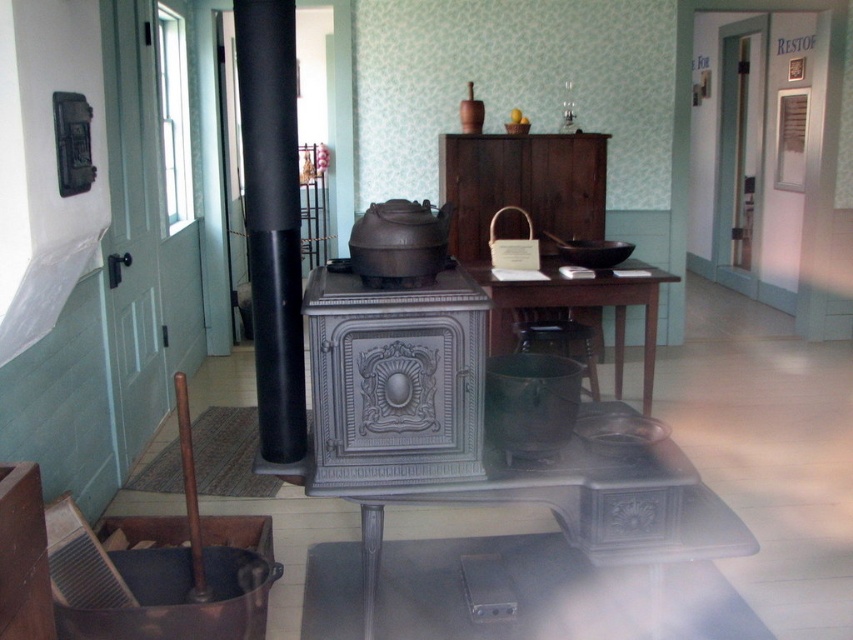
Question: Is metallic gray stove at center wider than wooden stool at center?

Choices:
 (A) yes
 (B) no

Answer: (A)

Question: Is dark wood table at center below wooden stool at center?

Choices:
 (A) yes
 (B) no

Answer: (B)

Question: Does dark wood table at center appear on the right side of wooden stool at center?

Choices:
 (A) no
 (B) yes

Answer: (B)

Question: Among these points, which one is farthest from the camera?

Choices:
 (A) (315, 445)
 (B) (613, 282)

Answer: (B)

Question: Which point is closer to the camera taking this photo?

Choices:
 (A) (361, 333)
 (B) (529, 337)
 (C) (503, 289)

Answer: (A)

Question: Which of these objects is positioned closest to the wooden stool at center?

Choices:
 (A) dark wood table at center
 (B) metallic gray stove at center

Answer: (A)